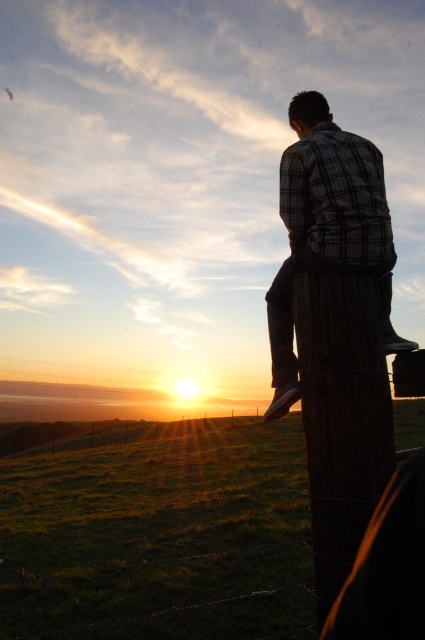
You are a photographer trying to capture the sunset scene. You notice the dark brown wooden post at right and the plaid fabric shirt at center in your frame. Based on their sizes in the image, which object would appear larger in your photo?

The dark brown wooden post at right appears much taller than the plaid fabric shirt at center in the image, so it would look larger in the photo.

You are a photographer trying to capture the sunset scene. You notice the dark brown wooden post at right and the plaid fabric shirt at center. Which object would block more of the sunset view if placed directly in front of the camera?

The dark brown wooden post at right has a larger size compared to plaid fabric shirt at center, so it would block more of the sunset view if placed directly in front of the camera.

Looking at this image, you are a photographer trying to capture the scene with a camera. You notice the dark brown wooden post at right and the plaid fabric shirt at center. Which object would block more of the sunset view if placed directly in front of the camera lens?

The dark brown wooden post at right would block more of the sunset view because its width is larger than the plaid fabric shirt at center.